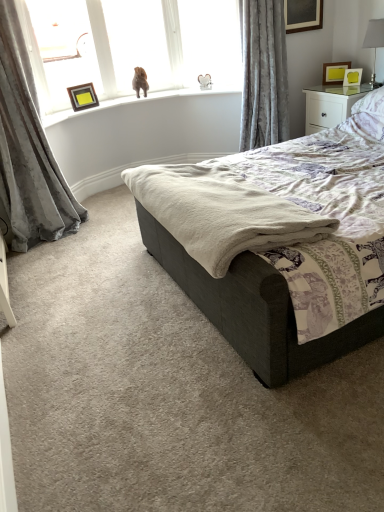
Image resolution: width=384 pixels, height=512 pixels. I want to click on white glossy nightstand at upper right, so click(331, 105).

The height and width of the screenshot is (512, 384). What do you see at coordinates (331, 105) in the screenshot? I see `white glossy nightstand at upper right` at bounding box center [331, 105].

Measure the distance between point [92,90] and camera.

Point [92,90] and camera are 3.78 meters apart.

The image size is (384, 512). What do you see at coordinates (61, 50) in the screenshot? I see `matte glass window screen at upper left` at bounding box center [61, 50].

The height and width of the screenshot is (512, 384). What do you see at coordinates (352, 77) in the screenshot? I see `gold metallic picture frame at upper right, which is the 3th picture frame in left-to-right order` at bounding box center [352, 77].

This screenshot has height=512, width=384. Describe the element at coordinates (220, 212) in the screenshot. I see `beige fleece blanket at center` at that location.

What is the approximate height of velvet gray curtain at upper right, which is the 2th curtain in left-to-right order?

1.18 meters.

What is the approximate width of dark gray fabric bed at center?

dark gray fabric bed at center is 7.46 feet wide.

This screenshot has height=512, width=384. What do you see at coordinates (371, 103) in the screenshot?
I see `white soft pillow at upper right` at bounding box center [371, 103].

The height and width of the screenshot is (512, 384). Identify the location of white glossy nightstand at upper right. (331, 105).

Between point (71, 98) and point (315, 122), which one is positioned behind?

The point (71, 98) is more distant.

Can you confirm if wooden picture frame at upper left, the first picture frame viewed from the left, is shorter than white glossy nightstand at upper right?

Yes.

Looking at the image, does wooden picture frame at upper left, the first picture frame viewed from the left, seem bigger or smaller compared to white glossy nightstand at upper right?

In the image, wooden picture frame at upper left, the first picture frame viewed from the left, appears to be smaller than white glossy nightstand at upper right.

From a real-world perspective, between wooden picture frame at upper left, marked as the 3th picture frame in a right-to-left arrangement, and white glossy nightstand at upper right, who is vertically higher?

wooden picture frame at upper left, marked as the 3th picture frame in a right-to-left arrangement, from a real-world perspective.

Looking at this image, considering the sizes of white glossy nightstand at upper right and beige fleece blanket at center in the image, is white glossy nightstand at upper right bigger or smaller than beige fleece blanket at center?

In the image, white glossy nightstand at upper right appears to be larger than beige fleece blanket at center.

I want to click on nightstand below the beige fleece blanket at center (from a real-world perspective), so click(331, 105).

Is white glossy nightstand at upper right positioned far away from beige fleece blanket at center?

white glossy nightstand at upper right is far away from beige fleece blanket at center.

In terms of height, does white glossy nightstand at upper right look taller or shorter compared to matte glass window screen at upper left?

Clearly, white glossy nightstand at upper right is shorter compared to matte glass window screen at upper left.

Is white glossy nightstand at upper right surrounding matte glass window screen at upper left?

Definitely not — matte glass window screen at upper left is not inside white glossy nightstand at upper right.

From the image's perspective, relative to matte glass window screen at upper left, is white glossy nightstand at upper right above or below?

Based on their image positions, white glossy nightstand at upper right is located beneath matte glass window screen at upper left.

Which is closer, [339,87] or [42,83]?

The point [42,83] is in front.

Does wooden picture frame at upper left, marked as the 3th picture frame in a right-to-left arrangement, touch velvet gray curtain at left, which is the 2th curtain from right to left?

They are not placed beside each other.

From a real-world perspective, is wooden picture frame at upper left, marked as the 3th picture frame in a right-to-left arrangement, located higher than velvet gray curtain at left, the first curtain viewed from the left?

Yes.

Where is `curtain that is the 2nd one below the wooden picture frame at upper left, the first picture frame viewed from the left (from a real-world perspective)`? The height and width of the screenshot is (512, 384). curtain that is the 2nd one below the wooden picture frame at upper left, the first picture frame viewed from the left (from a real-world perspective) is located at coordinates (28, 152).

Can you confirm if wooden picture frame at upper left, marked as the 3th picture frame in a right-to-left arrangement, is wider than velvet gray curtain at left, the first curtain viewed from the left?

No, wooden picture frame at upper left, marked as the 3th picture frame in a right-to-left arrangement, is not wider than velvet gray curtain at left, the first curtain viewed from the left.

Looking at this image, is beige fleece blanket at center inside the boundaries of white glossy table lamp at upper right, or outside?

beige fleece blanket at center is located beyond the bounds of white glossy table lamp at upper right.

Consider the image. Between beige fleece blanket at center and white glossy table lamp at upper right, which one appears on the left side from the viewer's perspective?

beige fleece blanket at center.

Would you consider beige fleece blanket at center to be distant from white glossy table lamp at upper right?

Absolutely, beige fleece blanket at center is distant from white glossy table lamp at upper right.

Is beige fleece blanket at center in front of or behind white glossy table lamp at upper right in the image?

Clearly, beige fleece blanket at center is in front of white glossy table lamp at upper right.

Is the depth of matte glass window screen at upper left greater than that of dark gray fabric bed at center?

Yes.

Could dark gray fabric bed at center be considered to be inside matte glass window screen at upper left?

No, matte glass window screen at upper left does not contain dark gray fabric bed at center.

Which of these two, matte glass window screen at upper left or dark gray fabric bed at center, stands taller?

dark gray fabric bed at center is taller.

From the image's perspective, is white glossy table lamp at upper right located above or below white glossy nightstand at upper right?

Based on their image positions, white glossy table lamp at upper right is located above white glossy nightstand at upper right.

Is white glossy table lamp at upper right at the right side of white glossy nightstand at upper right?

Yes, white glossy table lamp at upper right is to the right of white glossy nightstand at upper right.

Are white glossy table lamp at upper right and white glossy nightstand at upper right located far from each other?

white glossy table lamp at upper right is near white glossy nightstand at upper right, not far away.

This screenshot has width=384, height=512. I want to click on the 1st picture frame above the white glossy nightstand at upper right (from the image's perspective), so click(x=83, y=97).

Find the location of a particular element. This screenshot has width=384, height=512. nightstand that is under the beige fleece blanket at center (from a real-world perspective) is located at coordinates tap(331, 105).

Based on their spatial positions, is velvet gray curtain at left, which is the 2th curtain from right to left, or velvet gray curtain at upper right, the first curtain from the right, closer to dark gray fabric bed at center?

The object closer to dark gray fabric bed at center is velvet gray curtain at upper right, the first curtain from the right.

Considering their positions, is matte yellow picture frame at upper right, which is the second picture frame from left to right, positioned closer to dark gray fabric bed at center than white glossy table lamp at upper right?

Among the two, white glossy table lamp at upper right is located nearer to dark gray fabric bed at center.

When comparing their distances from matte glass window screen at upper left, does white soft pillow at upper right or gold metallic picture frame at upper right, which is the 3th picture frame in left-to-right order, seem further?

white soft pillow at upper right lies further to matte glass window screen at upper left than the other object.

In the scene shown: Looking at the image, which one is located closer to white glossy nightstand at upper right, gold metallic picture frame at upper right, which is counted as the first picture frame, starting from the right, or velvet gray curtain at upper right, which is the 2th curtain in left-to-right order?

gold metallic picture frame at upper right, which is counted as the first picture frame, starting from the right, lies closer to white glossy nightstand at upper right than the other object.

Based on their spatial positions, is gold metallic picture frame at upper right, which is the 3th picture frame in left-to-right order, or matte yellow picture frame at upper right, which is the second picture frame from left to right, closer to beige fleece blanket at center?

Based on the image, gold metallic picture frame at upper right, which is the 3th picture frame in left-to-right order, appears to be nearer to beige fleece blanket at center.

When comparing their distances from white soft pillow at upper right, does velvet gray curtain at left, the first curtain viewed from the left, or white glossy table lamp at upper right seem further?

velvet gray curtain at left, the first curtain viewed from the left, is positioned further to the anchor white soft pillow at upper right.

In the scene shown: Looking at the image, which one is located further to beige fleece blanket at center, dark gray fabric bed at center or velvet gray curtain at left, which is the 2th curtain from right to left?

Among the two, velvet gray curtain at left, which is the 2th curtain from right to left, is located further to beige fleece blanket at center.

Based on their spatial positions, is wooden picture frame at upper left, marked as the 3th picture frame in a right-to-left arrangement, or dark gray fabric bed at center further from white glossy nightstand at upper right?

wooden picture frame at upper left, marked as the 3th picture frame in a right-to-left arrangement, lies further to white glossy nightstand at upper right than the other object.

You are a GUI agent. You are given a task and a screenshot of the screen. Output one action in this format:
    pyautogui.click(x=<x>, y=<y>)
    Task: Click on the blanket between velvet gray curtain at left, which is the 2th curtain from right to left, and white soft pillow at upper right from left to right
    The width and height of the screenshot is (384, 512).
    Given the screenshot: What is the action you would take?
    pyautogui.click(x=220, y=212)

Where is `window screen positioned between beige fleece blanket at center and wooden picture frame at upper left, marked as the 3th picture frame in a right-to-left arrangement, from near to far`? This screenshot has width=384, height=512. window screen positioned between beige fleece blanket at center and wooden picture frame at upper left, marked as the 3th picture frame in a right-to-left arrangement, from near to far is located at coordinates (61, 50).

Where is `blanket between velvet gray curtain at left, the first curtain viewed from the left, and matte yellow picture frame at upper right, which ranks as the 2th picture frame in right-to-left order`? blanket between velvet gray curtain at left, the first curtain viewed from the left, and matte yellow picture frame at upper right, which ranks as the 2th picture frame in right-to-left order is located at coordinates (220, 212).

I want to click on pillow between dark gray fabric bed at center and wooden picture frame at upper left, the first picture frame viewed from the left, in the front-back direction, so click(371, 103).